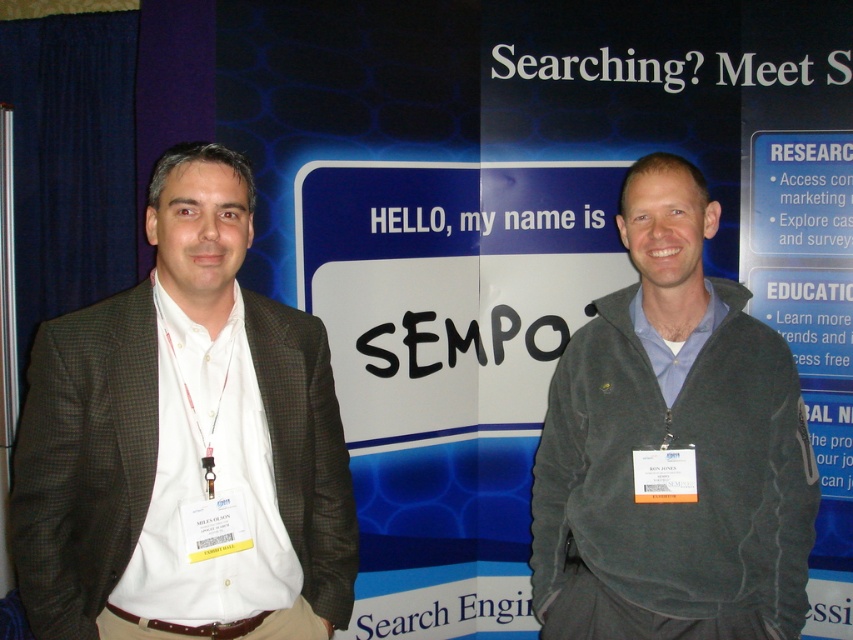
Between blue fabric banner at center and matte black suit at left, which one has less height?

Standing shorter between the two is matte black suit at left.

Is the position of blue fabric banner at center less distant than that of matte black suit at left?

No.

Which is in front, point (485, 243) or point (120, 429)?

Positioned in front is point (120, 429).

The height and width of the screenshot is (640, 853). What are the coordinates of `blue fabric banner at center` in the screenshot? It's located at (527, 243).

Who is positioned more to the left, blue fabric banner at center or dark gray fleece jacket at right?

dark gray fleece jacket at right

Describe the element at coordinates (527, 243) in the screenshot. I see `blue fabric banner at center` at that location.

The height and width of the screenshot is (640, 853). In order to click on blue fabric banner at center in this screenshot , I will do `click(527, 243)`.

How far apart are matte black suit at left and dark gray fleece jacket at right?

matte black suit at left and dark gray fleece jacket at right are 24.83 inches apart from each other.

Which is more to the right, matte black suit at left or dark gray fleece jacket at right?

dark gray fleece jacket at right is more to the right.

The height and width of the screenshot is (640, 853). What do you see at coordinates (181, 433) in the screenshot?
I see `matte black suit at left` at bounding box center [181, 433].

Find the location of a particular element. This screenshot has width=853, height=640. matte black suit at left is located at coordinates (181, 433).